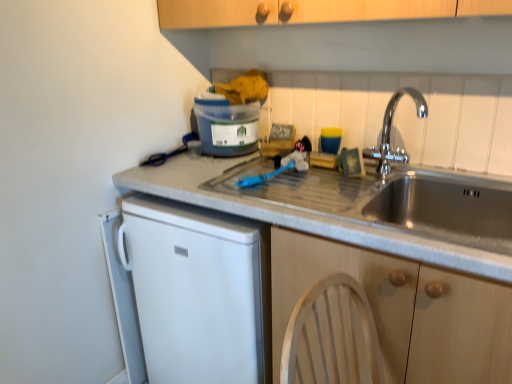
The width and height of the screenshot is (512, 384). Describe the element at coordinates (225, 125) in the screenshot. I see `matte plastic container at upper center` at that location.

Identify the location of matte plastic container at upper center. (225, 125).

Where is `chrome metallic faucet at upper right`? This screenshot has height=384, width=512. chrome metallic faucet at upper right is located at coordinates (390, 132).

This screenshot has height=384, width=512. Identify the location of matte plastic container at upper center. (225, 125).

From the picture: Between matte plastic container at upper center and wooden cabinet at lower right, which one has smaller width?

Thinner between the two is matte plastic container at upper center.

Is matte plastic container at upper center in contact with wooden cabinet at lower right?

matte plastic container at upper center is not next to wooden cabinet at lower right, and they're not touching.

Is matte plastic container at upper center smaller than wooden cabinet at lower right?

Indeed, matte plastic container at upper center has a smaller size compared to wooden cabinet at lower right.

From the picture: What's the angular difference between matte plastic container at upper center and wooden cabinet at lower right's facing directions?

They differ by 88.5 degrees in their facing directions.

Who is smaller, wooden cabinet at lower right or matte plastic container at upper center?

matte plastic container at upper center.

Choose the correct answer: Is wooden cabinet at lower right inside matte plastic container at upper center or outside it?

wooden cabinet at lower right is located beyond the bounds of matte plastic container at upper center.

From a real-world perspective, is wooden cabinet at lower right below matte plastic container at upper center?

Correct, in the physical world, wooden cabinet at lower right is lower than matte plastic container at upper center.

Is wooden cabinet at lower right positioned far away from matte plastic container at upper center?

wooden cabinet at lower right is near matte plastic container at upper center, not far away.

Can you tell me how much chrome metallic faucet at upper right and matte plastic container at upper center differ in facing direction?

The facing directions of chrome metallic faucet at upper right and matte plastic container at upper center are 41.9 degrees apart.

Does chrome metallic faucet at upper right come behind matte plastic container at upper center?

No, the depth of chrome metallic faucet at upper right is less than that of matte plastic container at upper center.

Would you say chrome metallic faucet at upper right is inside or outside matte plastic container at upper center?

chrome metallic faucet at upper right is spatially situated outside matte plastic container at upper center.

In the scene shown: From the image's perspective, which is below, chrome metallic faucet at upper right or matte plastic container at upper center?

chrome metallic faucet at upper right.

Considering the sizes of objects matte plastic container at upper center and chrome metallic faucet at upper right in the image provided, who is smaller, matte plastic container at upper center or chrome metallic faucet at upper right?

chrome metallic faucet at upper right is smaller.

I want to click on appliance located behind the chrome metallic faucet at upper right, so [x=225, y=125].

Which is more to the right, matte plastic container at upper center or chrome metallic faucet at upper right?

chrome metallic faucet at upper right is more to the right.

Could chrome metallic faucet at upper right be considered to be inside matte plastic container at upper center?

No, chrome metallic faucet at upper right is located outside of matte plastic container at upper center.

Which is in front, wooden cabinet at lower right or chrome metallic faucet at upper right?

wooden cabinet at lower right is in front.

Is wooden cabinet at lower right spatially inside chrome metallic faucet at upper right, or outside of it?

wooden cabinet at lower right cannot be found inside chrome metallic faucet at upper right.

Considering the positions of objects wooden cabinet at lower right and chrome metallic faucet at upper right in the image provided, who is more to the right, wooden cabinet at lower right or chrome metallic faucet at upper right?

chrome metallic faucet at upper right is more to the right.

Is wooden cabinet at lower right thinner than chrome metallic faucet at upper right?

Incorrect, the width of wooden cabinet at lower right is not less than that of chrome metallic faucet at upper right.

From a real-world perspective, which is physically above, chrome metallic faucet at upper right or wooden cabinet at lower right?

chrome metallic faucet at upper right.

Could you tell me if chrome metallic faucet at upper right is turned towards wooden cabinet at lower right?

No, chrome metallic faucet at upper right is not turned towards wooden cabinet at lower right.

Between chrome metallic faucet at upper right and wooden cabinet at lower right, which one has smaller width?

chrome metallic faucet at upper right.

In the image, is chrome metallic faucet at upper right positioned in front of or behind wooden cabinet at lower right?

Clearly, chrome metallic faucet at upper right is behind wooden cabinet at lower right.

Image resolution: width=512 pixels, height=384 pixels. What are the coordinates of `cabinetry located on the right of matte plastic container at upper center` in the screenshot? It's located at (403, 310).

This screenshot has width=512, height=384. Identify the location of appliance on the left of wooden cabinet at lower right. (225, 125).

From the image, which object appears to be nearer to chrome metallic faucet at upper right, wooden cabinet at lower right or matte plastic container at upper center?

matte plastic container at upper center is positioned closer to the anchor chrome metallic faucet at upper right.

Looking at the image, which one is located further to matte plastic container at upper center, chrome metallic faucet at upper right or wooden cabinet at lower right?

The object further to matte plastic container at upper center is wooden cabinet at lower right.

Which object lies nearer to the anchor point chrome metallic faucet at upper right, matte plastic container at upper center or wooden cabinet at lower right?

matte plastic container at upper center lies closer to chrome metallic faucet at upper right than the other object.

Considering their positions, is wooden cabinet at lower right positioned further to matte plastic container at upper center than chrome metallic faucet at upper right?

Based on the image, wooden cabinet at lower right appears to be further to matte plastic container at upper center.

Considering their positions, is chrome metallic faucet at upper right positioned closer to wooden cabinet at lower right than matte plastic container at upper center?

chrome metallic faucet at upper right is positioned closer to the anchor wooden cabinet at lower right.

When comparing their distances from wooden cabinet at lower right, does matte plastic container at upper center or chrome metallic faucet at upper right seem further?

matte plastic container at upper center.

This screenshot has width=512, height=384. In order to click on tap between wooden cabinet at lower right and matte plastic container at upper center from front to back in this screenshot , I will do `click(390, 132)`.